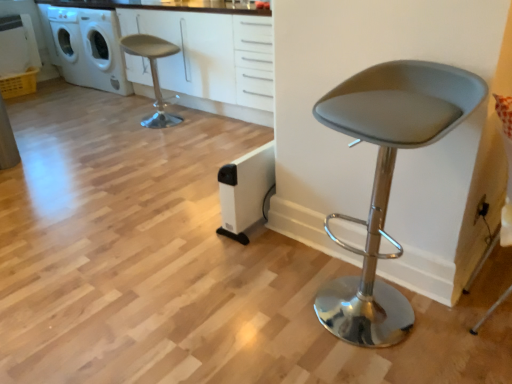
Locate an element on the screen. The width and height of the screenshot is (512, 384). vacant region under matte gray stool at center, marked as the 1th chair in a bottom-to-top arrangement (from a real-world perspective) is located at coordinates (364, 332).